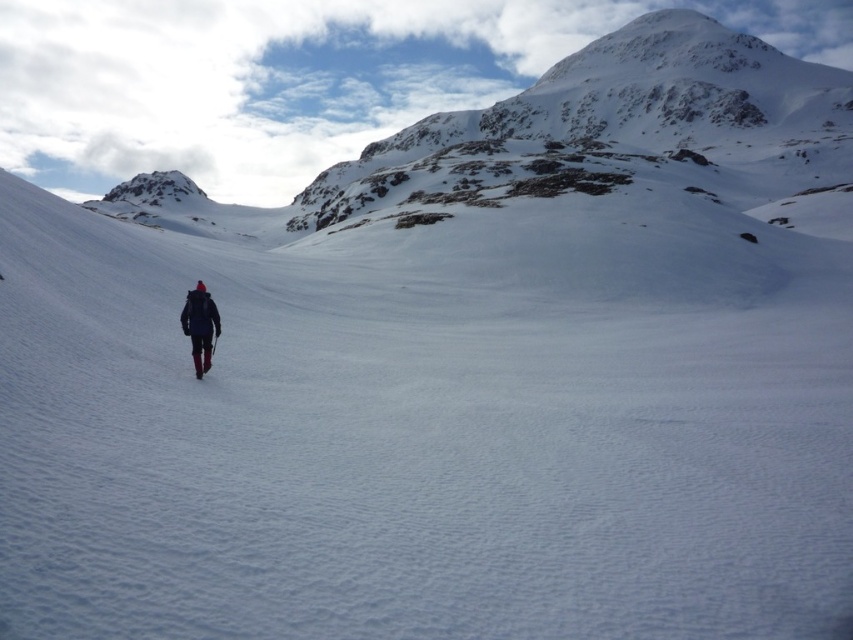
Looking at this image, you are a photographer capturing the winter scene. You need to position your camera so that the dark blue fabric jacket at center and the matte black ski at center are both visible. Which object should you place on the left side of your frame?

The dark blue fabric jacket at center should be placed on the left side of your frame because it is to the left of the matte black ski at center.

You are a hiker who just arrived at the winter landscape. You see the point marked at coordinates (x=200, y=324). What object is this point located on?

The point marked at coordinates (x=200, y=324) is located on the dark blue fabric jacket at center.

You are a photographer trying to capture the winter scene. You notice the dark blue fabric jacket at center and the matte black ski at center. Which object is positioned higher in the image?

The dark blue fabric jacket at center is located above the matte black ski at center, so it is positioned higher in the image.